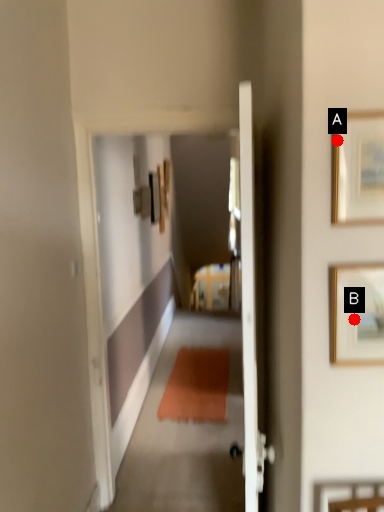
Question: Two points are circled on the image, labeled by A and B beside each circle. Which point appears farthest from the camera in this image?

Choices:
 (A) A is further
 (B) B is further

Answer: (B)